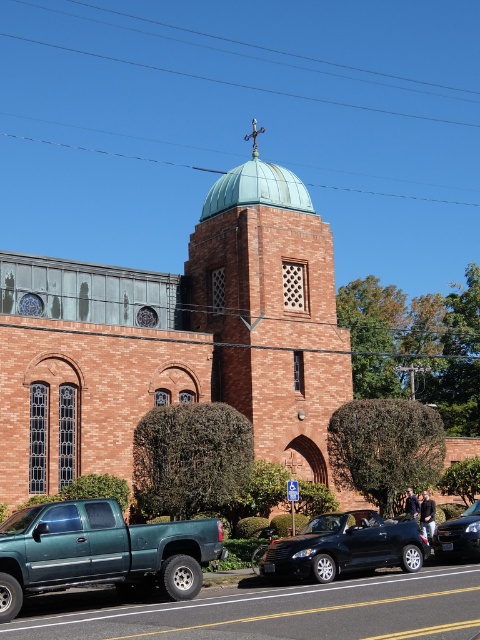
Is brick church at center wider than teal matte dome at center?

Yes.

Which is behind, point (276, 248) or point (244, 164)?

Positioned behind is point (244, 164).

In order to click on brick church at center in this screenshot , I will do 177,339.

Which is more to the left, teal brick tower at center or black matte convertible at center?

Positioned to the left is teal brick tower at center.

Which is above, teal brick tower at center or black matte convertible at center?

teal brick tower at center is above.

What do you see at coordinates (271, 310) in the screenshot? I see `teal brick tower at center` at bounding box center [271, 310].

This screenshot has height=640, width=480. I want to click on teal brick tower at center, so coord(271,310).

Between point (17, 548) and point (398, 522), which one is positioned in front?

Point (17, 548) is more forward.

Who is lower down, teal matte truck at lower left or black matte convertible at center?

black matte convertible at center is below.

The image size is (480, 640). I want to click on teal matte truck at lower left, so click(100, 552).